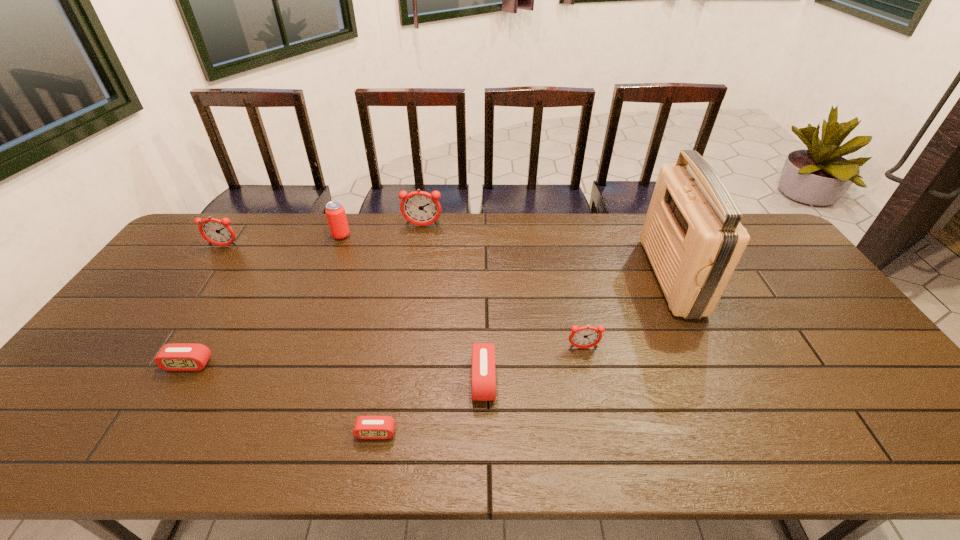
Image resolution: width=960 pixels, height=540 pixels. I want to click on free space located on the front of the sixth object from right to left, so click(315, 302).

Identify the location of vacant area located on the front-facing side of the second farthest reddish-pink alarm clock. (207, 270).

I want to click on free space located on the front-facing side of the rightmost reddish-pink alarm clock, so click(603, 436).

Find the location of a particular element. This screenshot has width=960, height=540. blank space located 0.390m on the front-facing side of the fourth tallest alarm clock is located at coordinates (316, 380).

This screenshot has height=540, width=960. In order to click on free space located 0.130m on the front-facing side of the fourth tallest alarm clock in this screenshot , I will do `click(420, 380)`.

Where is `vacant space located 0.060m on the front-facing side of the fourth tallest alarm clock`? vacant space located 0.060m on the front-facing side of the fourth tallest alarm clock is located at coordinates (448, 380).

Find the location of a particular element. The image size is (960, 540). vacant area situated 0.060m on the front-facing side of the second shortest object is located at coordinates (172, 392).

This screenshot has height=540, width=960. I want to click on radio receiver that is at the far edge, so click(x=692, y=235).

Where is `beer can located at the far edge`? Image resolution: width=960 pixels, height=540 pixels. beer can located at the far edge is located at coordinates (335, 212).

Where is `object that is at the near edge`? The height and width of the screenshot is (540, 960). object that is at the near edge is located at coordinates click(x=366, y=427).